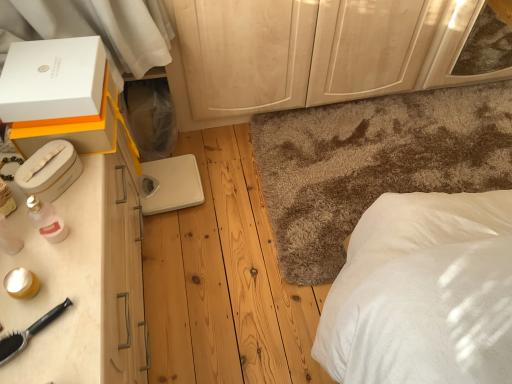
You are a GUI agent. You are given a task and a screenshot of the screen. Output one action in this format:
    pyautogui.click(x=<x>, y=<y>)
    Task: Click on the vacant area that is situated to the right of pink glass perfume at left
    
    Given the screenshot: What is the action you would take?
    pyautogui.click(x=87, y=233)